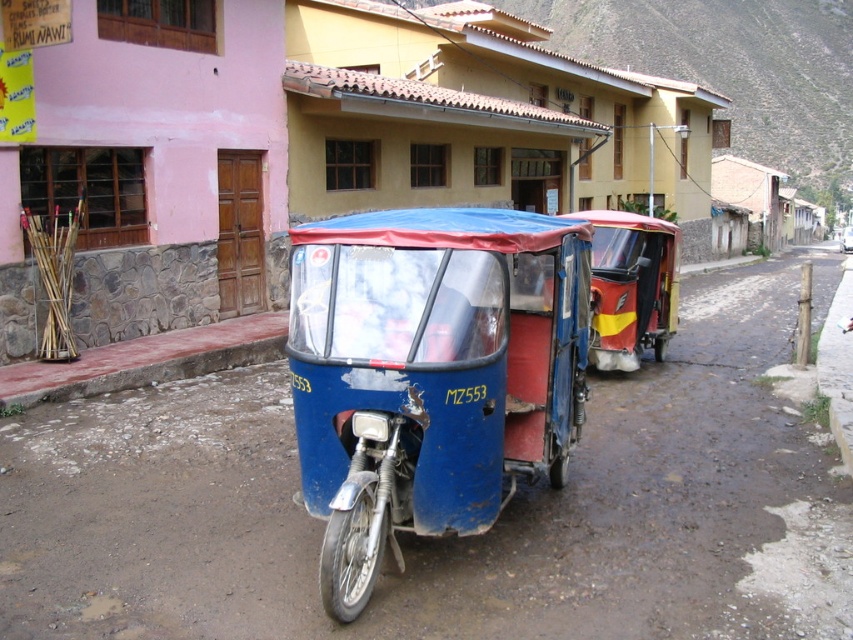
You are a delivery person who needs to move a 6 meter long pipe between the blue matte tricycle at center and the red glossy tricycle at center. Can you fit the pipe between them without bending it?

The distance between the blue matte tricycle at center and the red glossy tricycle at center is 5.53 meters. Since the pipe is 6 meters long, it is longer than the available space. Therefore, the pipe cannot be placed between them without bending it.

You are a tourist standing on the dirt road and want to take a photo of both the blue matte tricycle at center and the red glossy tricycle at center. Which tricycle should you focus on first to ensure both are in the frame?

You should focus on the blue matte tricycle at center first because it is closer to you, so adjusting the camera to include it will naturally include the red glossy tricycle at center which is further back.